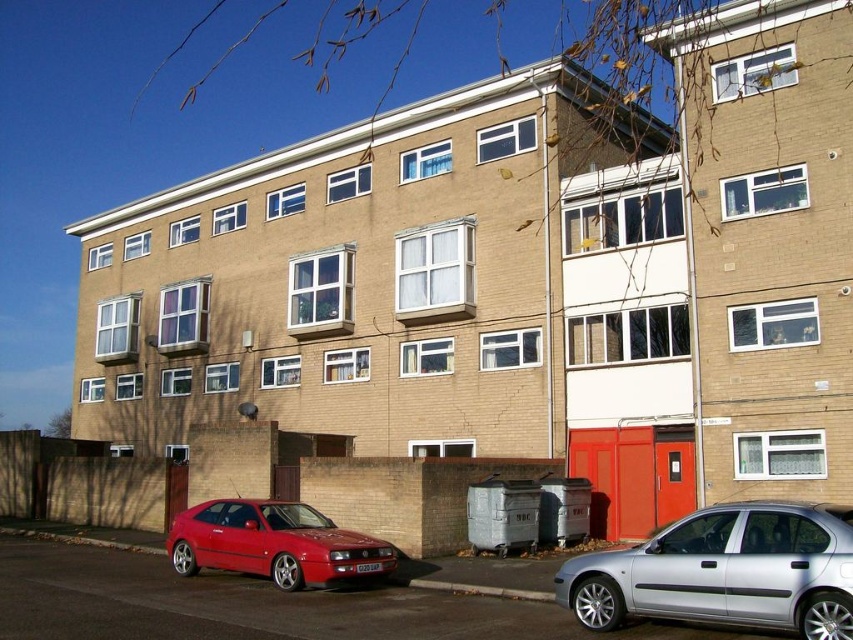
Can you confirm if silver metallic sedan at lower right is taller than glossy red car at lower left?

Yes, silver metallic sedan at lower right is taller than glossy red car at lower left.

Is silver metallic sedan at lower right closer to camera compared to glossy red car at lower left?

Yes, silver metallic sedan at lower right is closer to the viewer.

Which is in front, point (730, 576) or point (279, 580)?

Positioned in front is point (730, 576).

In order to click on silver metallic sedan at lower right in this screenshot , I will do `click(724, 572)`.